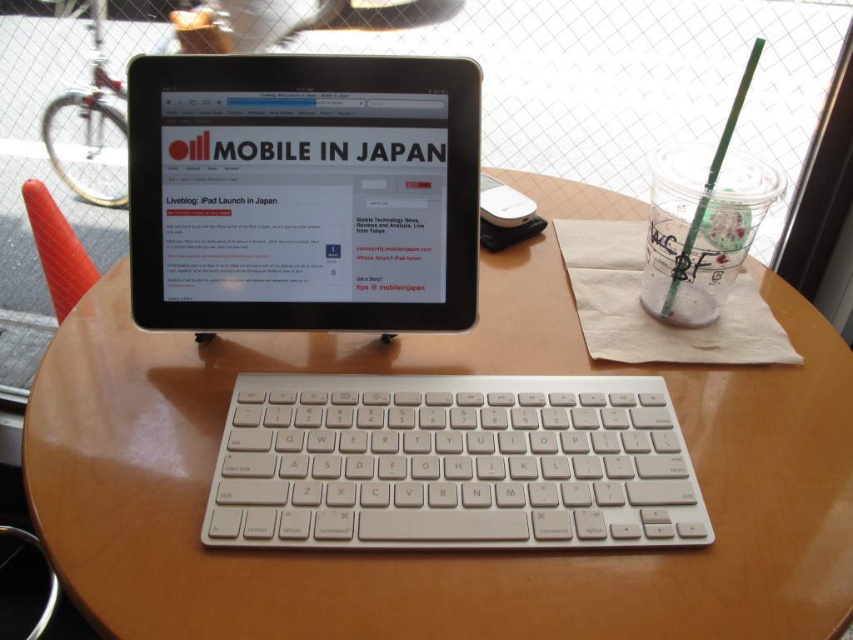
You are setting up a new workspace and want to place a laptop on the wooden table at center. According to the image, where exactly should you place the laptop?

The wooden table at center is located at point coordinates of (x=430, y=550), so you should place the laptop there.